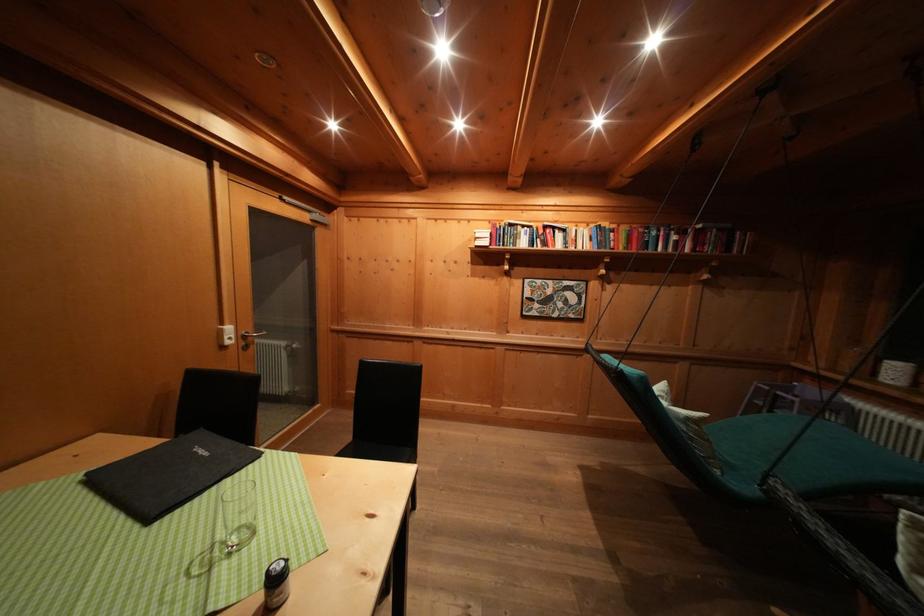
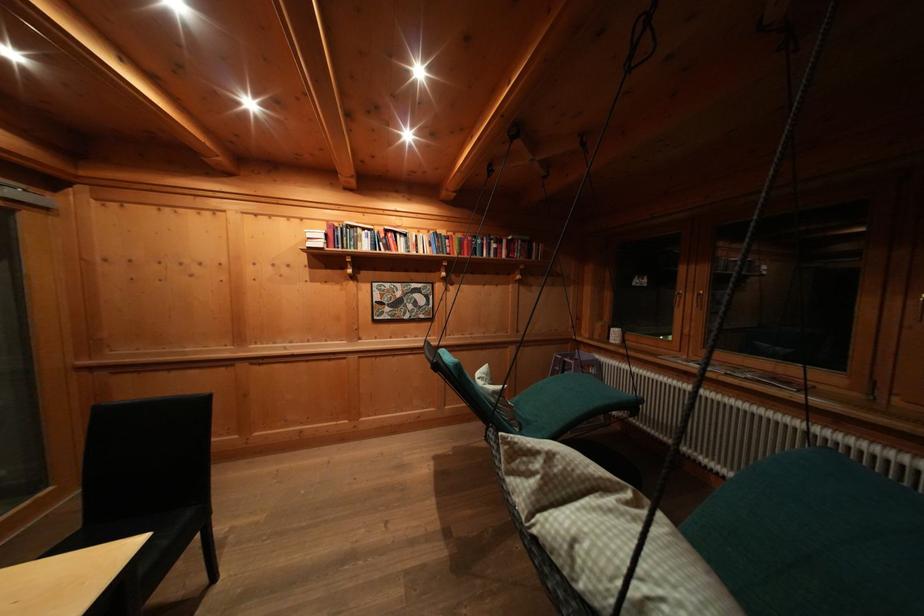
Question: How did the camera likely rotate?

Choices:
 (A) Left
 (B) Right
 (C) Up
 (D) Down

Answer: (B)